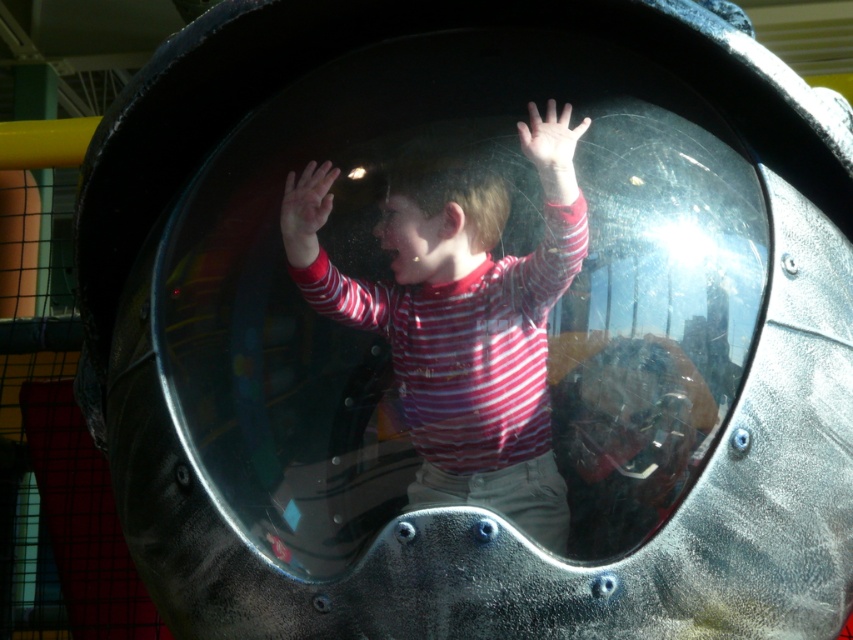
Does striped fabric child at center appear over matte red striped shirt at center?

Actually, striped fabric child at center is below matte red striped shirt at center.

Between striped fabric child at center and matte red striped shirt at center, which one has more height?

Standing taller between the two is striped fabric child at center.

Who is more forward, (532,388) or (312,198)?

Point (532,388) is more forward.

This screenshot has width=853, height=640. What are the coordinates of `striped fabric child at center` in the screenshot? It's located at (467, 337).

Can you confirm if transparent plastic bubble at center is thinner than striped fabric child at center?

Incorrect, transparent plastic bubble at center's width is not less than striped fabric child at center's.

Does point (258, 189) lie in front of point (439, 321)?

No, it is not.

Between point (589, 180) and point (440, 214), which one is positioned in front?

Point (440, 214) is more forward.

The image size is (853, 640). Find the location of `transparent plastic bubble at center`. transparent plastic bubble at center is located at coordinates (448, 292).

Measure the distance from transparent plastic bubble at center to smooth skin hand at upper center.

transparent plastic bubble at center and smooth skin hand at upper center are 8.17 inches apart.

Is transparent plastic bubble at center bigger than smooth skin hand at upper center?

Indeed, transparent plastic bubble at center has a larger size compared to smooth skin hand at upper center.

Who is more distant from viewer, [263,177] or [546,166]?

Positioned behind is point [263,177].

Locate an element on the screen. transparent plastic bubble at center is located at coordinates (448, 292).